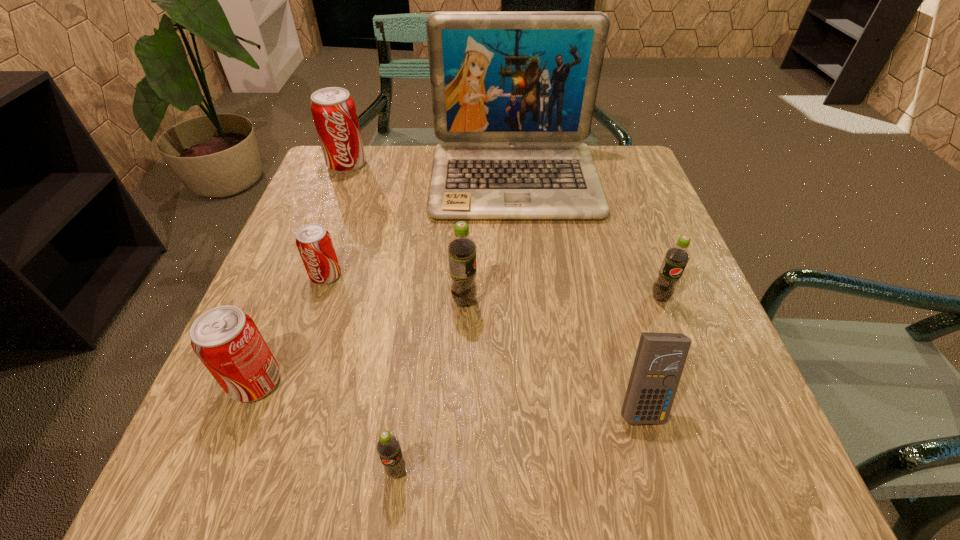
Locate an element on the screen. The height and width of the screenshot is (540, 960). the smallest red soda can is located at coordinates (314, 243).

I want to click on the sixth nearest object, so click(314, 243).

Identify the location of the nearest soda. The height and width of the screenshot is (540, 960). (388, 448).

You are a GUI agent. You are given a task and a screenshot of the screen. Output one action in this format:
    pyautogui.click(x=<x>, y=<y>)
    Task: Click on the nearest green soda
    Image resolution: width=960 pixels, height=540 pixels.
    Given the screenshot: What is the action you would take?
    pyautogui.click(x=388, y=448)

Find the location of `blank area located on the screen of the tallest object`. blank area located on the screen of the tallest object is located at coordinates (530, 349).

You are a GUI agent. You are given a task and a screenshot of the screen. Output one action in this format:
    pyautogui.click(x=<x>, y=<y>)
    Task: Click on the free space located 0.310m on the right of the farthest soda
    The image size is (960, 540).
    Given the screenshot: What is the action you would take?
    pyautogui.click(x=478, y=164)

The image size is (960, 540). I want to click on vacant space located on the front label of the second soda from right to left, so click(x=634, y=301).

The image size is (960, 540). I want to click on free spot located on the front label of the rightmost soda, so click(x=729, y=479).

The width and height of the screenshot is (960, 540). I want to click on vacant region located on the back of the second nearest soda, so click(x=304, y=259).

I want to click on vacant space situated 0.340m on the front of the smallest red soda can, so click(x=266, y=452).